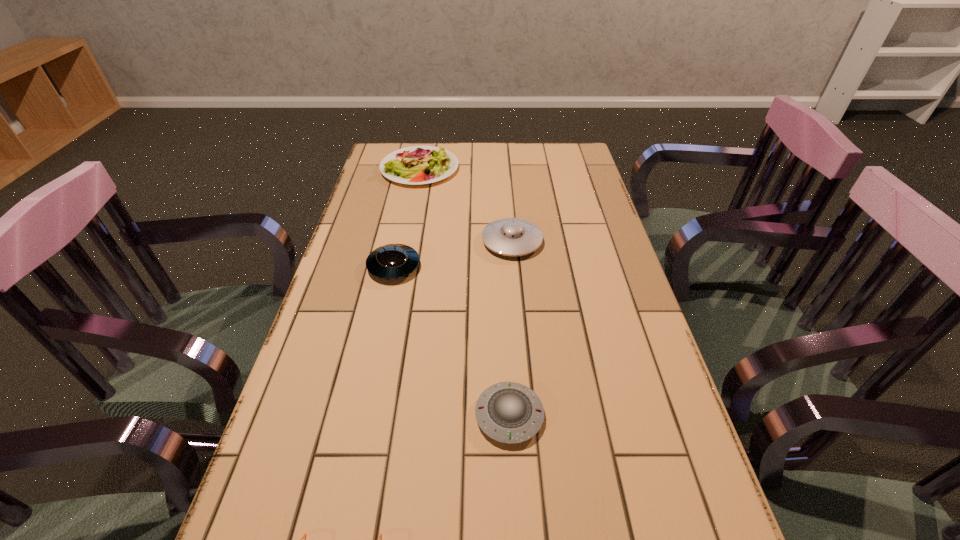
Identify the location of free space that satisfies the following two spatial constraints: 1. on the front side of the shortest saucer; 2. on the right side of the salad plate. (371, 415).